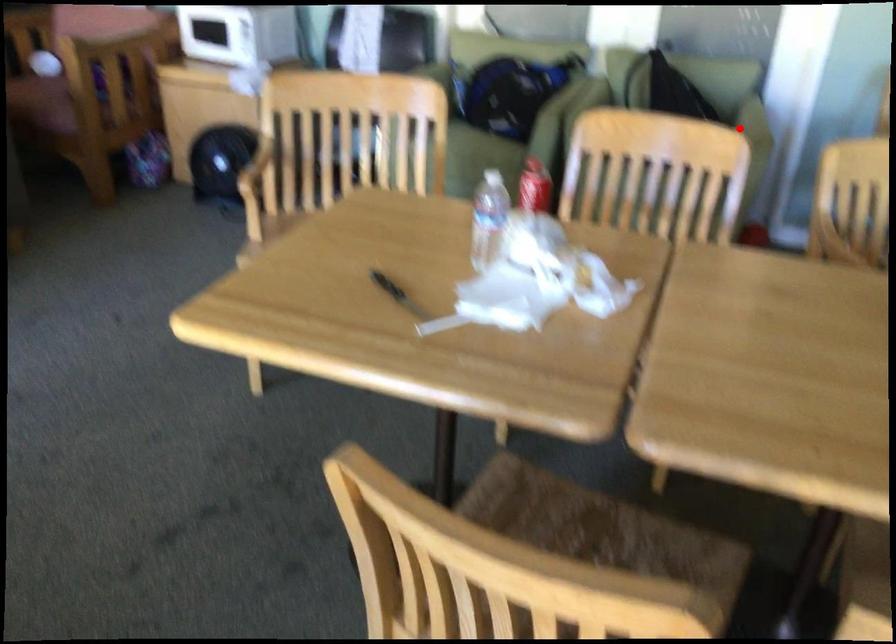
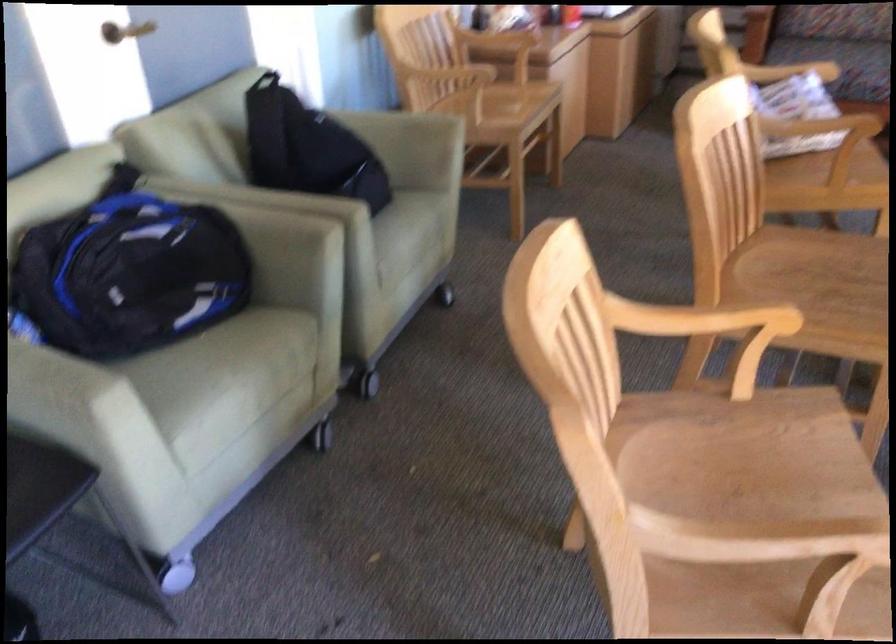
Question: A red point is marked in image1. In image2, is the corresponding 3D point closer to the camera or farther? Reply with the corresponding letter.

Choices:
 (A) The corresponding 3D point is closer.
 (B) The corresponding 3D point is farther.

Answer: (A)